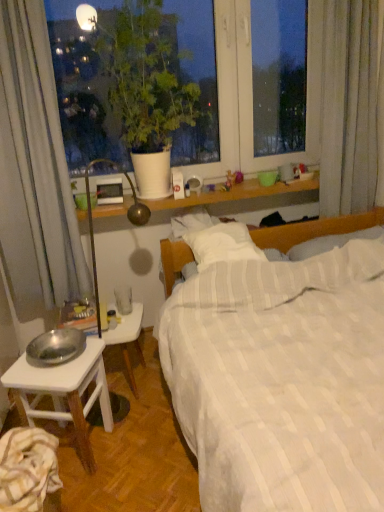
Describe the element at coordinates (28, 469) in the screenshot. The width and height of the screenshot is (384, 512). I see `striped cotton sheet at lower left` at that location.

Image resolution: width=384 pixels, height=512 pixels. What do you see at coordinates (55, 347) in the screenshot? I see `metallic silver bowl at lower left` at bounding box center [55, 347].

Identify the location of metallic silver bowl at lower left. The height and width of the screenshot is (512, 384). (55, 347).

Where is `white striped fabric at center`? This screenshot has width=384, height=512. white striped fabric at center is located at coordinates 282,380.

The height and width of the screenshot is (512, 384). I want to click on white matte plant pot at upper left, so pos(146,87).

This screenshot has width=384, height=512. What do you see at coordinates (332, 243) in the screenshot?
I see `white soft pillow at center` at bounding box center [332, 243].

This screenshot has width=384, height=512. What do you see at coordinates (64, 392) in the screenshot? I see `silver metallic bowl at lower left` at bounding box center [64, 392].

You are a GUI agent. You are given a task and a screenshot of the screen. Output one action in this format:
    pyautogui.click(x=<x>, y=<y>)
    Task: Click on the striped cotton sheet at lower left
    Image resolution: width=384 pixels, height=512 pixels.
    Given the screenshot: What is the action you would take?
    pyautogui.click(x=28, y=469)

Considering the positions of objects white wooden table at lower left and white matte plant pot at upper left in the image provided, who is in front, white wooden table at lower left or white matte plant pot at upper left?

white matte plant pot at upper left is in front.

Would you say white wooden table at lower left is inside or outside white matte plant pot at upper left?

white wooden table at lower left is not enclosed by white matte plant pot at upper left.

Looking at their sizes, would you say white wooden table at lower left is wider or thinner than white matte plant pot at upper left?

In the image, white wooden table at lower left appears to be more narrow than white matte plant pot at upper left.

From a real-world perspective, who is located lower, white wooden table at lower left or white matte plant pot at upper left?

In real-world perspective, white wooden table at lower left is lower.

From the image's perspective, relative to striped cotton sheet at lower left, is silver metallic bowl at lower left above or below?

Based on their image positions, silver metallic bowl at lower left is located above striped cotton sheet at lower left.

Looking at this image, considering the relative positions of silver metallic bowl at lower left and striped cotton sheet at lower left in the image provided, is silver metallic bowl at lower left to the right of striped cotton sheet at lower left from the viewer's perspective?

Yes.

Considering the relative sizes of silver metallic bowl at lower left and striped cotton sheet at lower left in the image provided, is silver metallic bowl at lower left thinner than striped cotton sheet at lower left?

In fact, silver metallic bowl at lower left might be wider than striped cotton sheet at lower left.

From the image's perspective, is white matte plant pot at upper left located beneath silver metallic bowl at lower left?

No.

Looking at this image, considering the positions of objects white matte plant pot at upper left and silver metallic bowl at lower left in the image provided, who is more to the left, white matte plant pot at upper left or silver metallic bowl at lower left?

silver metallic bowl at lower left is more to the left.

Locate an element on the screen. Image resolution: width=384 pixels, height=512 pixels. desk to the left of white matte plant pot at upper left is located at coordinates (64, 392).

Is point (155, 123) closer or farther from the camera than point (75, 376)?

Point (155, 123) is farther from the camera than point (75, 376).

Is striped cotton sheet at lower left beside metallic silver bowl at lower left?

No, striped cotton sheet at lower left is not beside metallic silver bowl at lower left.

Considering the positions of point (47, 449) and point (54, 362), is point (47, 449) closer or farther from the camera than point (54, 362)?

Clearly, point (47, 449) is closer to the camera than point (54, 362).

Considering the relative sizes of striped cotton sheet at lower left and metallic silver bowl at lower left in the image provided, is striped cotton sheet at lower left smaller than metallic silver bowl at lower left?

No.

Relative to metallic silver bowl at lower left, is silver metallic bowl at lower left in front or behind?

silver metallic bowl at lower left is in front of metallic silver bowl at lower left.

Locate an element on the screen. The image size is (384, 512). desk in front of the metallic silver bowl at lower left is located at coordinates (64, 392).

In terms of size, does silver metallic bowl at lower left appear bigger or smaller than metallic silver bowl at lower left?

Clearly, silver metallic bowl at lower left is larger in size than metallic silver bowl at lower left.

Considering the relative positions of silver metallic bowl at lower left and metallic silver bowl at lower left in the image provided, is silver metallic bowl at lower left to the left of metallic silver bowl at lower left from the viewer's perspective?

No, silver metallic bowl at lower left is not to the left of metallic silver bowl at lower left.

Is white wooden table at lower left oriented away from silver metallic bowl at lower left?

No, white wooden table at lower left is not facing the opposite direction of silver metallic bowl at lower left.

Would you say white wooden table at lower left contains silver metallic bowl at lower left?

That's incorrect, silver metallic bowl at lower left is not inside white wooden table at lower left.

Considering the points (135, 347) and (90, 361), which point is in front, point (135, 347) or point (90, 361)?

The point (90, 361) is more forward.

Which object is positioned more to the left, white wooden table at lower left or silver metallic bowl at lower left?

From the viewer's perspective, silver metallic bowl at lower left appears more on the left side.

Based on their sizes in the image, would you say striped cotton sheet at lower left is bigger or smaller than white matte plant pot at upper left?

striped cotton sheet at lower left is smaller than white matte plant pot at upper left.

Looking at this image, is striped cotton sheet at lower left completely or partially outside of white matte plant pot at upper left?

Yes.

This screenshot has height=512, width=384. I want to click on houseplant above the striped cotton sheet at lower left (from a real-world perspective), so click(x=146, y=87).

From a real-world perspective, is striped cotton sheet at lower left positioned above or below white matte plant pot at upper left?

→ Clearly, from a real-world perspective, striped cotton sheet at lower left is below white matte plant pot at upper left.

What are the coordinates of `houseplant in front of the white wooden table at lower left` in the screenshot? It's located at click(x=146, y=87).

Locate an element on the screen. desk on the right of striped cotton sheet at lower left is located at coordinates (64, 392).

When comparing their distances from silver metallic bowl at lower left, does metallic silver bowl at lower left or white soft pillow at center seem closer?

metallic silver bowl at lower left lies closer to silver metallic bowl at lower left than the other object.

Looking at this image, from the image, which object appears to be farther from white matte plant pot at upper left, white wooden table at lower left or white soft pillow at center?

white soft pillow at center is positioned further to the anchor white matte plant pot at upper left.

Which object lies further to the anchor point white matte plant pot at upper left, metallic silver bowl at lower left or striped cotton sheet at lower left?

The object further to white matte plant pot at upper left is striped cotton sheet at lower left.

From the image, which object appears to be farther from white striped fabric at center, metallic silver bowl at lower left or white matte plant pot at upper left?

Among the two, white matte plant pot at upper left is located further to white striped fabric at center.

When comparing their distances from white wooden table at lower left, does metallic silver bowl at lower left or white soft pillow at center seem further?

Based on the image, white soft pillow at center appears to be further to white wooden table at lower left.

From the image, which object appears to be farther from white striped fabric at center, white soft pillow at center or silver metallic bowl at lower left?

The object further to white striped fabric at center is white soft pillow at center.

Which object lies nearer to the anchor point white striped fabric at center, striped cotton sheet at lower left or white wooden table at lower left?

white wooden table at lower left is closer to white striped fabric at center.

When comparing their distances from white soft pillow at center, does white matte plant pot at upper left or striped cotton sheet at lower left seem closer?

white matte plant pot at upper left.

Locate an element on the screen. The image size is (384, 512). sheet between metallic silver bowl at lower left and white striped fabric at center is located at coordinates (28, 469).

Locate an element on the screen. The image size is (384, 512). pillow between white matte plant pot at upper left and striped cotton sheet at lower left in the up-down direction is located at coordinates (332, 243).

The image size is (384, 512). I want to click on sheet positioned between white striped fabric at center and white soft pillow at center from near to far, so click(28, 469).

You are a GUI agent. You are given a task and a screenshot of the screen. Output one action in this format:
    pyautogui.click(x=<x>, y=<y>)
    Task: Click on the bowl between white matte plant pot at upper left and striped cotton sheet at lower left in the up-down direction
    
    Given the screenshot: What is the action you would take?
    pyautogui.click(x=55, y=347)